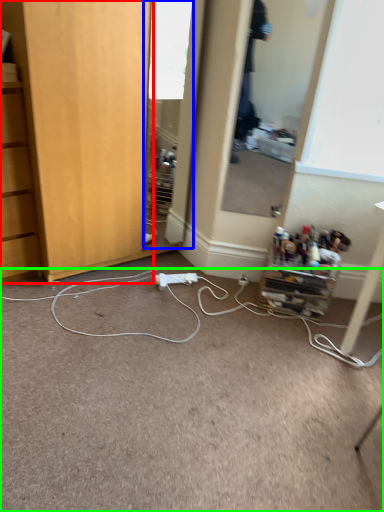
Question: Which object is positioned closest to cabinetry (highlighted by a red box)? Select from mirror (highlighted by a blue box) and plain (highlighted by a green box).

Choices:
 (A) mirror
 (B) plain

Answer: (B)